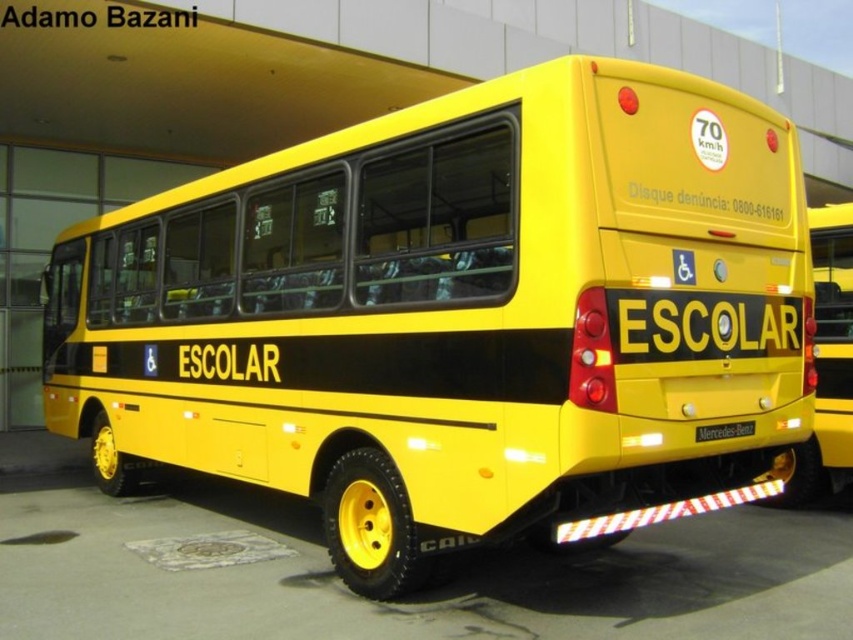
You are a city inspector checking the placement of regulatory signs on a school bus. According to the image, where is the yellow matte bus at right located relative to the point marked by coordinates point (833, 342)?

The point (833, 342) indicates the location of the yellow matte bus at right, so the bus is exactly at that coordinate point.